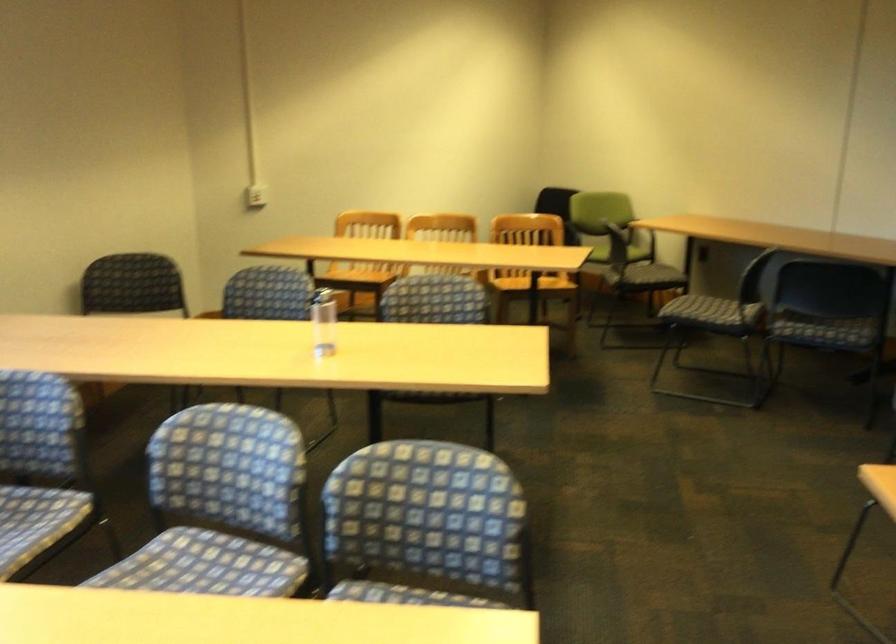
Locate an element on the screen. This screenshot has width=896, height=644. green chair armrest is located at coordinates (221, 506).